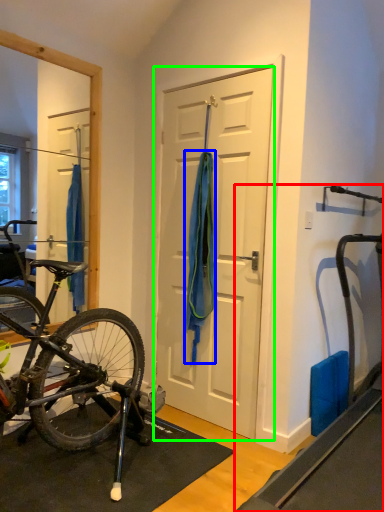
Question: Considering the real-world distances, which object is farthest from treadmill (highlighted by a red box)? towel/napkin (highlighted by a blue box) or door (highlighted by a green box)?

Choices:
 (A) towel/napkin
 (B) door

Answer: (A)